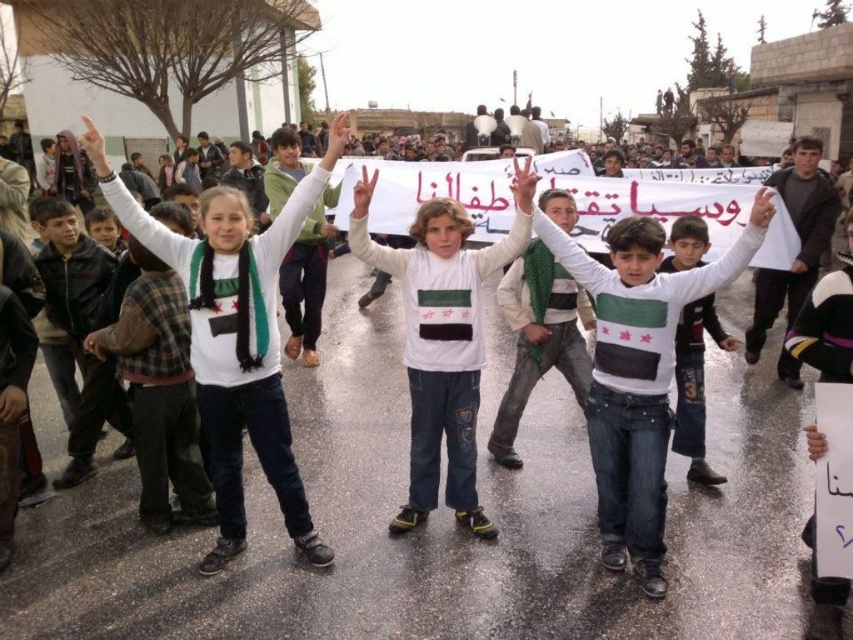
You are a photographer trying to capture a clear photo of the white cotton shirt at center and the white sweater at center. Which one should you focus on first if you want to ensure both are in focus, given their heights?

The white cotton shirt at center is much taller than the white sweater at center, so focusing on the taller one first would help ensure both are in focus.

You are a photographer trying to capture a photo of the white cotton shirt at center and the white sweater at center. The camera you are using has a maximum focus range of 4 feet. Can you fit both objects in the frame without moving the camera?

The distance between the white cotton shirt at center and the white sweater at center is 4.31 feet, which exceeds the camera maximum focus range of 4 feet. Therefore, you cannot fit both objects in the frame without moving the camera.

What are the coordinates of the white cotton shirt at center?

The white cotton shirt at center is located at coordinates point (639, 372).